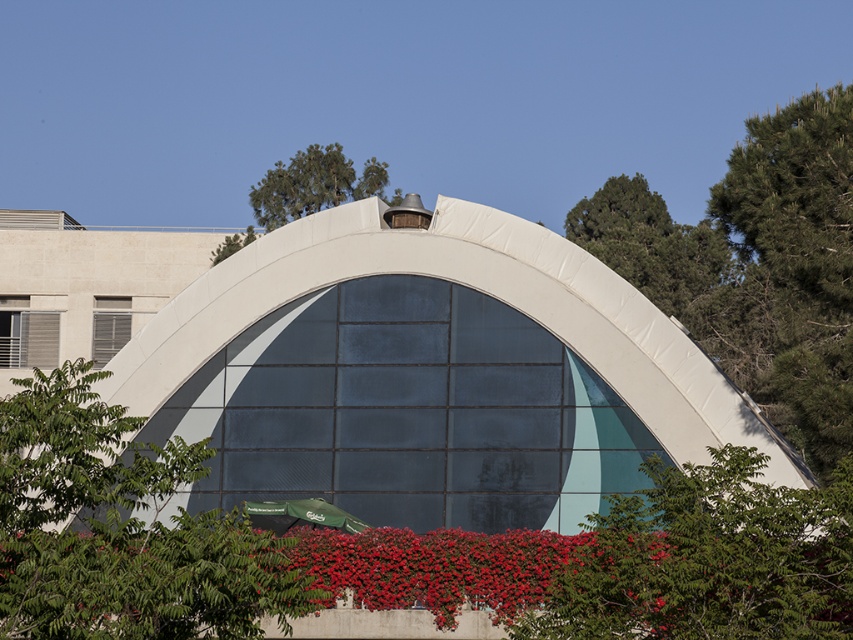
Question: Does green leafy tree at lower right appear on the right side of white mesh window at left?

Choices:
 (A) no
 (B) yes

Answer: (B)

Question: Which point appears closest to the camera in this image?

Choices:
 (A) (57, 337)
 (B) (200, 516)
 (C) (352, 538)
 (D) (109, 304)

Answer: (B)

Question: Is green leafy tree at upper center positioned before white mesh window at left?

Choices:
 (A) no
 (B) yes

Answer: (A)

Question: Which is nearer to the white mesh window at left?

Choices:
 (A) green leafy tree at lower right
 (B) vibrant red petals at lower center
 (C) green leafy tree at lower left

Answer: (B)

Question: Is green leafy tree at lower left closer to the viewer compared to green leafy tree at lower right?

Choices:
 (A) yes
 (B) no

Answer: (A)

Question: Which point appears farthest from the camera in this image?

Choices:
 (A) (511, 552)
 (B) (822, 577)
 (C) (99, 333)
 (D) (225, 566)

Answer: (C)